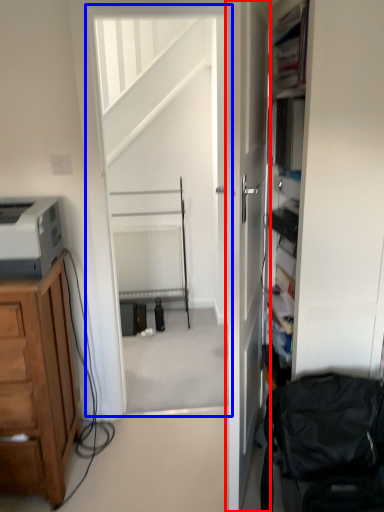
Question: Which object appears closest to the camera in this image, door (highlighted by a red box) or screen door (highlighted by a blue box)?

Choices:
 (A) door
 (B) screen door

Answer: (A)